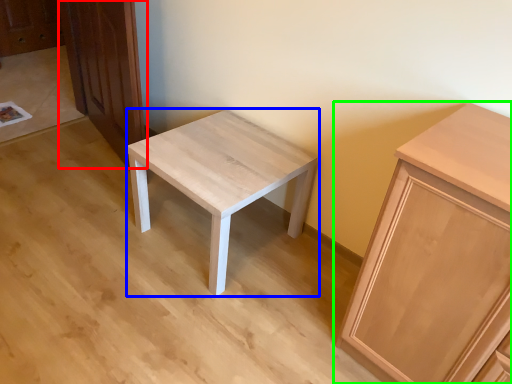
Question: Considering the real-world distances, which object is farthest from dresser (highlighted by a red box)? stool (highlighted by a blue box) or cabinetry (highlighted by a green box)?

Choices:
 (A) stool
 (B) cabinetry

Answer: (B)